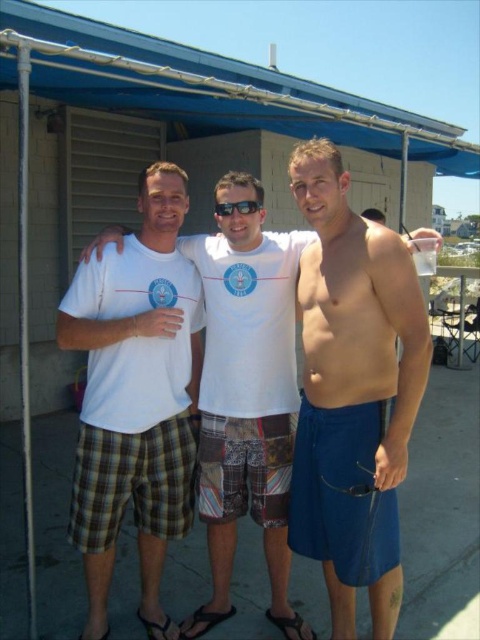
You are planning to set up a temporary shade structure for a beach event. You have the blue fabric canopy at upper center and the black plastic goggles at center available. Which item would be more suitable for providing shade to a group of people?

The blue fabric canopy at upper center is larger in size than the black plastic goggles at center, making it more suitable for providing shade to a group of people.

In the scene shown: You are designing a layout for a magazine cover and need to place two elements next to each other. You have a photo of plaid shorts at left and a photo of blue fabric canopy at upper center. Based on their widths, which photo should be placed on the left side of the magazine cover to ensure they fit properly?

The plaid shorts at left should be placed on the left side of the magazine cover because it is thinner than the blue fabric canopy at upper center, allowing both elements to fit side by side without overlapping.